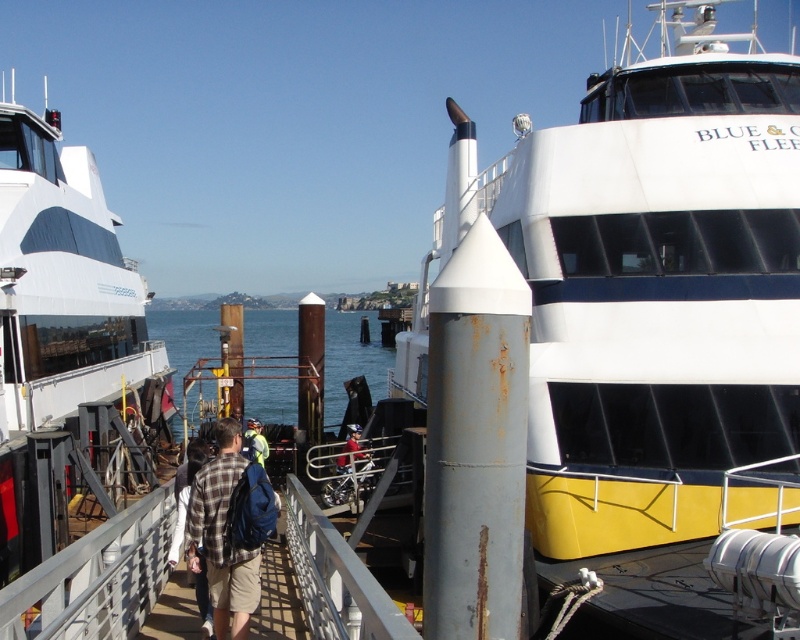
Does point (633, 168) lie in front of point (262, 440)?

That is True.

Is white matte boat at center closer to the viewer compared to plaid shirt at center?

That is True.

What do you see at coordinates (648, 291) in the screenshot? I see `white matte boat at center` at bounding box center [648, 291].

Where is `white matte boat at center`? white matte boat at center is located at coordinates pyautogui.click(x=648, y=291).

Does white matte boat at center have a larger size compared to plaid fabric shirt at center?

Correct, white matte boat at center is larger in size than plaid fabric shirt at center.

Is white matte boat at center smaller than plaid fabric shirt at center?

No.

Is point (716, 426) behind point (208, 540)?

Yes, point (716, 426) is farther from viewer.

Locate an element on the screen. The image size is (800, 640). white matte boat at center is located at coordinates (648, 291).

Between white matte boat at left and blue water at center, which one appears on the left side from the viewer's perspective?

Positioned to the left is blue water at center.

Does white matte boat at left appear on the right side of blue water at center?

Correct, you'll find white matte boat at left to the right of blue water at center.

Is point (80, 545) closer to camera compared to point (193, 390)?

Yes, point (80, 545) is closer to viewer.

Locate an element on the screen. Image resolution: width=800 pixels, height=640 pixels. white matte boat at left is located at coordinates (72, 401).